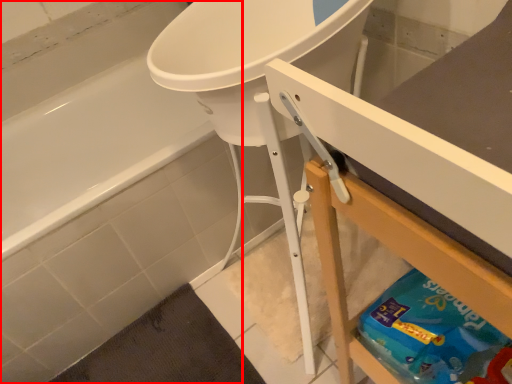
Question: From the image's perspective, where is bathtub (annotated by the red box) located relative to counter?

Choices:
 (A) below
 (B) above

Answer: (B)